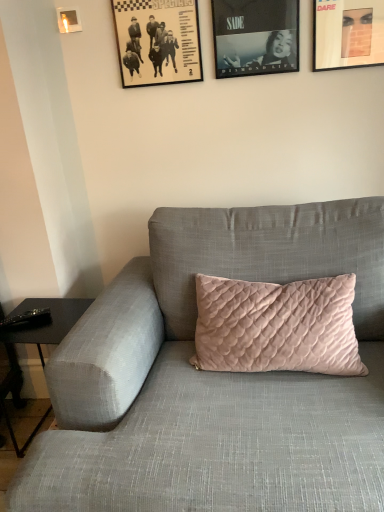
Question: Is point (74, 29) positioned closer to the camera than point (311, 204)?

Choices:
 (A) closer
 (B) farther

Answer: (B)

Question: Looking at their shapes, would you say metallic gold picture frame at upper left, which ranks as the first picture frame in left-to-right order, is wider or thinner than velvet pink pillow at center?

Choices:
 (A) wide
 (B) thin

Answer: (B)

Question: Which object is the closest to the velvet pink pillow at center?

Choices:
 (A) matte black picture frame at upper right, placed as the first picture frame when sorted from right to left
 (B) black paper picture frame at upper center, the 2th picture frame in the left-to-right sequence
 (C) matte black picture frame at upper center, marked as the 3th picture frame in a left-to-right arrangement
 (D) metallic gold picture frame at upper left, which ranks as the first picture frame in left-to-right order

Answer: (B)

Question: Which object is positioned closest to the metallic gold picture frame at upper left, the fourth picture frame viewed from the right?

Choices:
 (A) matte black picture frame at upper center, which is the 2th picture frame in right-to-left order
 (B) matte black picture frame at upper right, placed as the first picture frame when sorted from right to left
 (C) velvet pink pillow at center
 (D) black paper picture frame at upper center, arranged as the 3th picture frame when viewed from the right

Answer: (D)